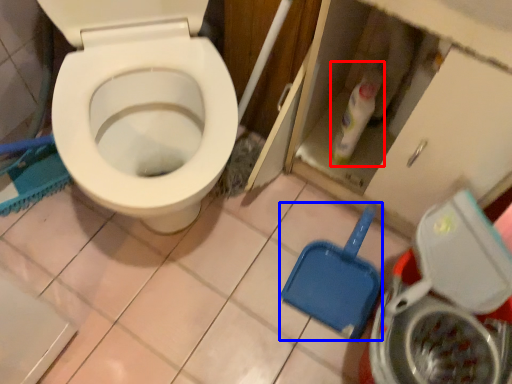
Question: Which object is closer to the camera taking this photo, cleaning product (highlighted by a red box) or shovel (highlighted by a blue box)?

Choices:
 (A) cleaning product
 (B) shovel

Answer: (A)